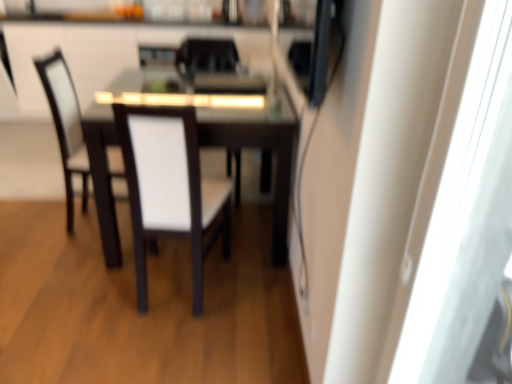
At what (x,y) coordinates should I click in order to perform the action: click on free space in front of white fabric chair at center, marked as the third chair in a back-to-front arrangement. Please return your answer as a coordinate pair (x, y). Image resolution: width=512 pixels, height=384 pixels. Looking at the image, I should click on (68, 263).